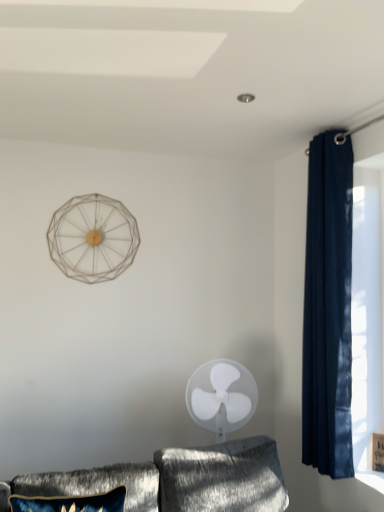
Question: From the image's perspective, would you say navy velvet curtain at right is shown under velvet blue pillow at lower left?

Choices:
 (A) no
 (B) yes

Answer: (A)

Question: Does navy velvet curtain at right have a greater width compared to velvet blue pillow at lower left?

Choices:
 (A) yes
 (B) no

Answer: (B)

Question: Is navy velvet curtain at right further to camera compared to velvet blue pillow at lower left?

Choices:
 (A) yes
 (B) no

Answer: (A)

Question: Can you confirm if navy velvet curtain at right is taller than velvet blue pillow at lower left?

Choices:
 (A) yes
 (B) no

Answer: (A)

Question: Can you confirm if navy velvet curtain at right is smaller than velvet blue pillow at lower left?

Choices:
 (A) no
 (B) yes

Answer: (A)

Question: Visually, is velvet blue pillow at lower left positioned to the left or to the right of white plastic fan at center?

Choices:
 (A) right
 (B) left

Answer: (B)

Question: Is velvet blue pillow at lower left taller or shorter than white plastic fan at center?

Choices:
 (A) short
 (B) tall

Answer: (A)

Question: Do you think velvet blue pillow at lower left is within white plastic fan at center, or outside of it?

Choices:
 (A) inside
 (B) outside

Answer: (B)

Question: Looking at the image, does velvet blue pillow at lower left seem bigger or smaller compared to white plastic fan at center?

Choices:
 (A) big
 (B) small

Answer: (B)

Question: Is white plastic fan at center bigger or smaller than navy velvet curtain at right?

Choices:
 (A) small
 (B) big

Answer: (B)

Question: Is point (215, 419) positioned closer to the camera than point (334, 374)?

Choices:
 (A) farther
 (B) closer

Answer: (A)

Question: Is white plastic fan at center wider or thinner than navy velvet curtain at right?

Choices:
 (A) thin
 (B) wide

Answer: (B)

Question: In the image, is white plastic fan at center on the left side or the right side of navy velvet curtain at right?

Choices:
 (A) left
 (B) right

Answer: (A)

Question: Relative to velvet blue pillow at lower left, is navy velvet curtain at right in front or behind?

Choices:
 (A) behind
 (B) front

Answer: (A)

Question: Looking at the image, does navy velvet curtain at right seem bigger or smaller compared to velvet blue pillow at lower left?

Choices:
 (A) big
 (B) small

Answer: (A)